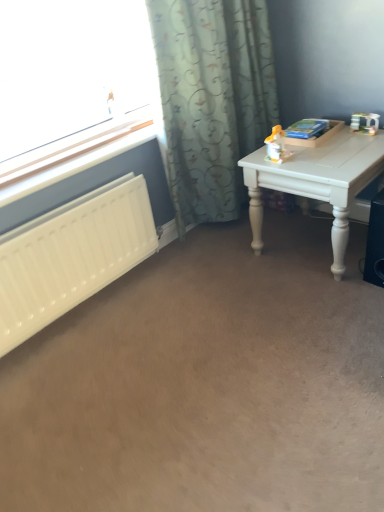
Question: Is yellow plastic toy at upper right spatially inside black plastic speaker at lower right, or outside of it?

Choices:
 (A) inside
 (B) outside

Answer: (B)

Question: Does point (266, 138) appear closer or farther from the camera than point (364, 276)?

Choices:
 (A) farther
 (B) closer

Answer: (A)

Question: Which of these objects is positioned closest to the patterned fabric curtain at upper center?

Choices:
 (A) white plastic radiator at left
 (B) yellow plastic toy at upper right
 (C) black plastic speaker at lower right
 (D) white painted wood table at right
 (E) white matte radiator at left

Answer: (B)

Question: Considering the real-world distances, which object is closest to the white matte radiator at left?

Choices:
 (A) black plastic speaker at lower right
 (B) yellow plastic toy at upper right
 (C) white plastic radiator at left
 (D) white painted wood table at right
 (E) patterned fabric curtain at upper center

Answer: (C)